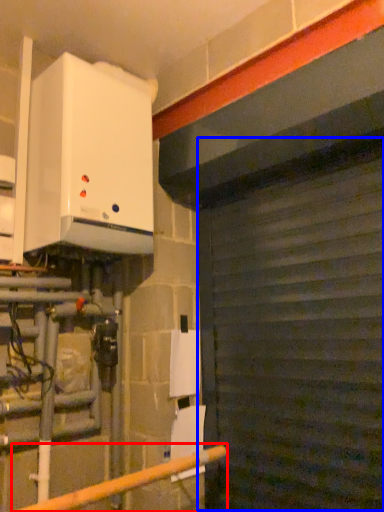
Question: Among these objects, which one is farthest to the camera, rail (highlighted by a red box) or garage door (highlighted by a blue box)?

Choices:
 (A) rail
 (B) garage door

Answer: (B)